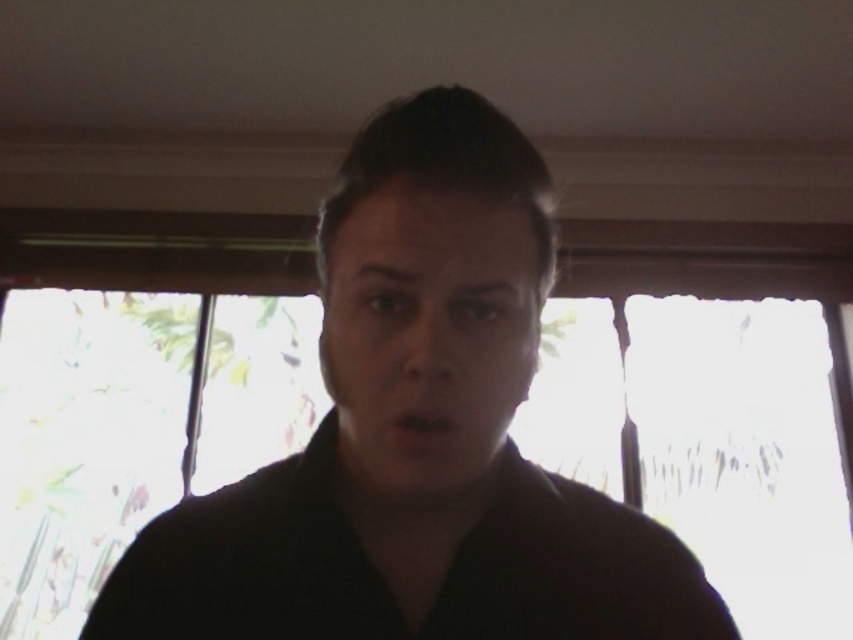
How far apart are black matte robe at center and matte black face at center?

The distance of black matte robe at center from matte black face at center is 3.38 inches.

Who is taller, black matte robe at center or matte black face at center?

Standing taller between the two is matte black face at center.

The width and height of the screenshot is (853, 640). What are the coordinates of `black matte robe at center` in the screenshot? It's located at point(386,582).

Image resolution: width=853 pixels, height=640 pixels. Find the location of `black matte robe at center`. black matte robe at center is located at coordinates (386, 582).

Which of these two, black matte shirt at center or black matte robe at center, stands taller?

black matte shirt at center

Between black matte shirt at center and black matte robe at center, which one has less height?

black matte robe at center is shorter.

Describe the element at coordinates (416, 436) in the screenshot. The height and width of the screenshot is (640, 853). I see `black matte shirt at center` at that location.

Locate an element on the screen. This screenshot has height=640, width=853. black matte shirt at center is located at coordinates (416, 436).

Can you confirm if black matte shirt at center is positioned to the left of matte black face at center?

Incorrect, black matte shirt at center is not on the left side of matte black face at center.

Which is behind, point (334, 480) or point (421, 417)?

The point (334, 480) is behind.

Does point (445, 346) come in front of point (463, 211)?

That is True.

Locate an element on the screen. The height and width of the screenshot is (640, 853). black matte shirt at center is located at coordinates coord(416,436).